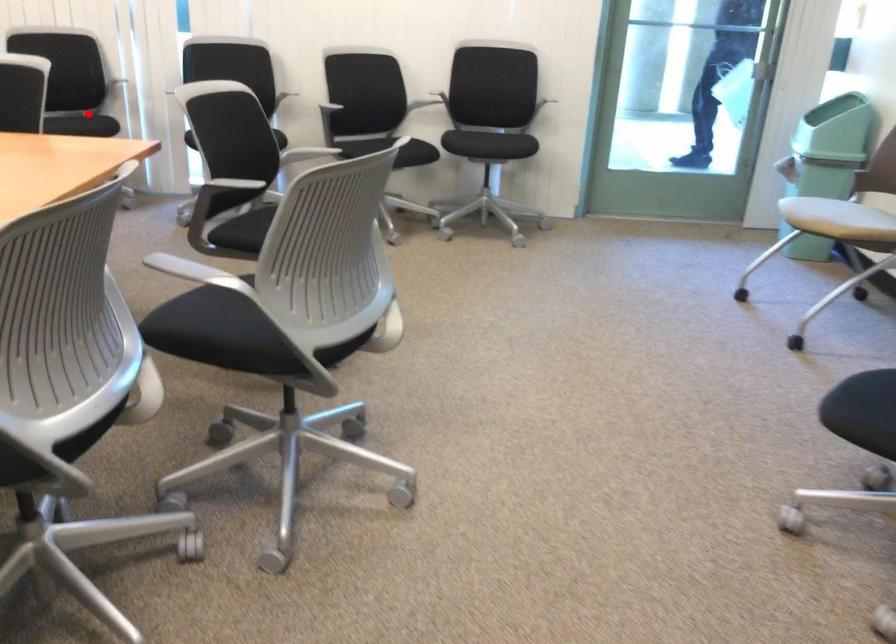
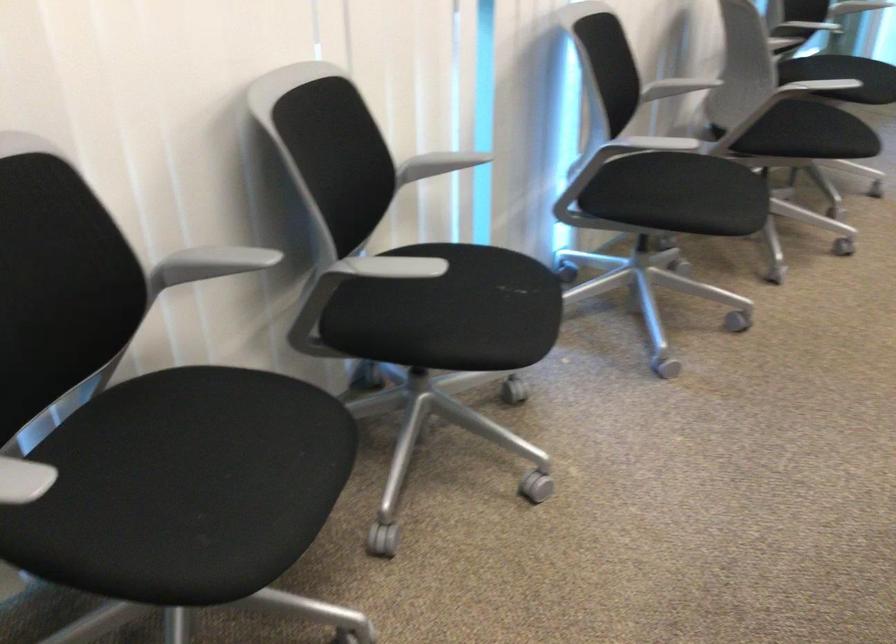
In the second image, find the point that corresponds to the highlighted location in the first image.

(515, 287)